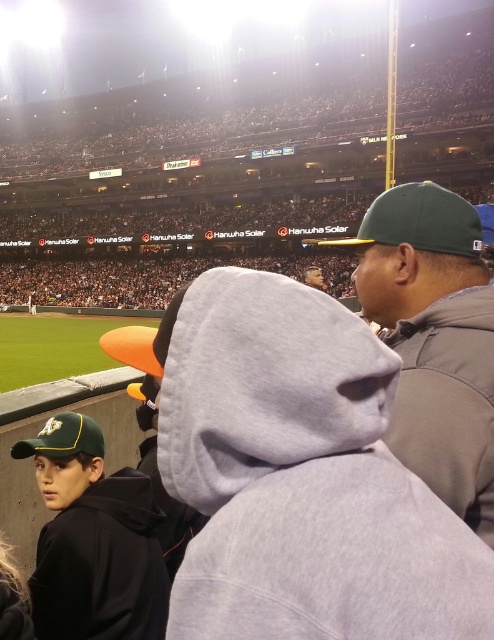
Question: Which object is positioned farthest from the green fabric baseball cap at upper right?

Choices:
 (A) green fabric cap at upper right
 (B) matte black hoodie at lower left
 (C) green matte baseball cap at lower left

Answer: (A)

Question: Which point appears farthest from the camera in this image?

Choices:
 (A) (51, 458)
 (B) (488, 300)
 (C) (319, 243)

Answer: (C)

Question: Does green fabric cap at upper right have a greater width compared to matte black hoodie at lower left?

Choices:
 (A) no
 (B) yes

Answer: (A)

Question: Estimate the real-world distances between objects in this image. Which object is farther from the green fabric cap at upper right?

Choices:
 (A) green matte baseball cap at lower left
 (B) matte black hoodie at lower left
 (C) green fabric baseball cap at upper right

Answer: (C)

Question: In this image, where is matte black hoodie at lower left located relative to green matte baseball cap at lower left?

Choices:
 (A) below
 (B) above

Answer: (A)

Question: Considering the relative positions of green fabric cap at upper right and green fabric baseball cap at upper right in the image provided, where is green fabric cap at upper right located with respect to green fabric baseball cap at upper right?

Choices:
 (A) above
 (B) below

Answer: (B)